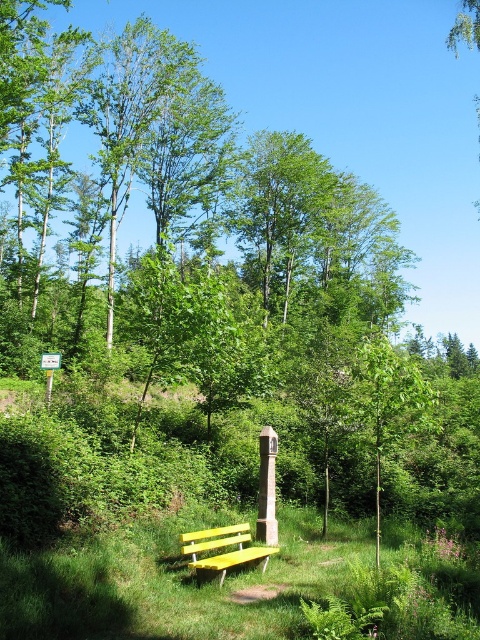
Can you confirm if green grass at lower center is positioned to the right of yellow painted wood bench at lower center?

Correct, you'll find green grass at lower center to the right of yellow painted wood bench at lower center.

Which is above, green grass at lower center or yellow painted wood bench at lower center?

green grass at lower center is above.

At what (x,y) coordinates should I click in order to perform the action: click on green grass at lower center. Please return your answer as a coordinate pair (x, y). Looking at the image, I should click on (233, 582).

The image size is (480, 640). Find the location of `green grass at lower center`. green grass at lower center is located at coordinates (233, 582).